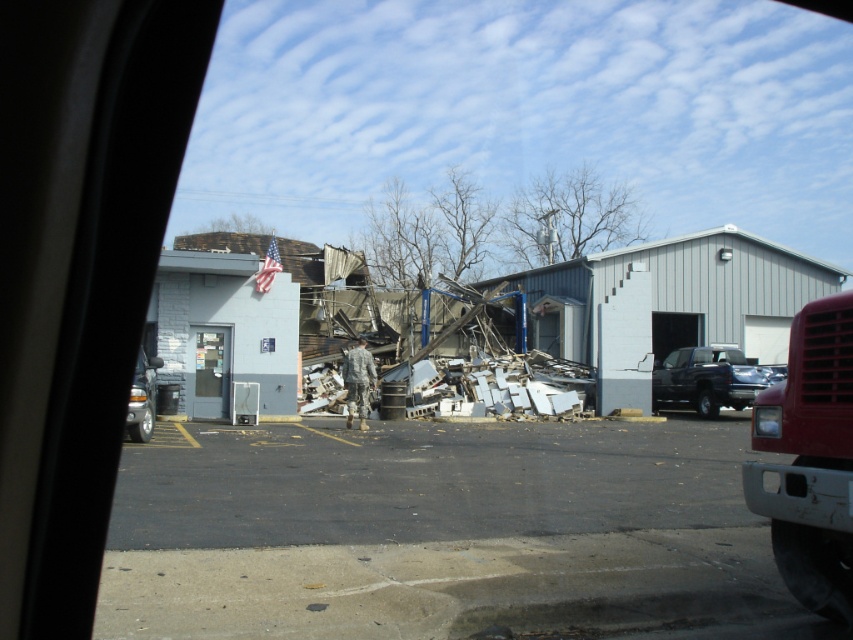
You are a delivery driver needing to navigate between the matte black truck at right and the matte silver truck at left parked in front of the collapsed building. Which truck is closer to you as you approach from the road?

The matte black truck at right is closer to you because it is positioned further to the viewer than the matte silver truck at left, meaning it is nearer in the line of sight.

You are a delivery driver who needs to park your matte black truck at right near the clear glass vending machine at center. Based on the scene, can you safely park the truck directly in front of the vending machine without blocking it?

The matte black truck at right is below the clear glass vending machine at center, meaning it is positioned lower in the image. Since the truck is already placed below the vending machine, parking it directly in front might not block the vending machine as they are aligned vertically. However, ensure there is enough space between them for safety.